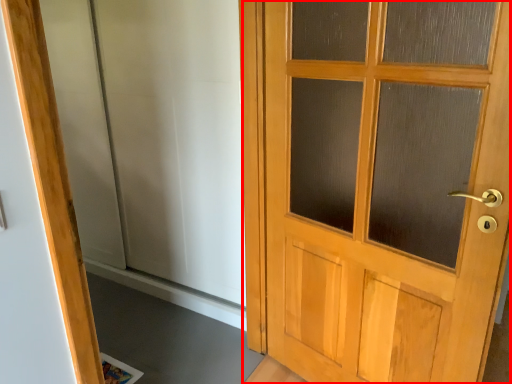
Question: From the image's perspective, considering the relative positions of door (annotated by the red box) and elevator in the image provided, where is door (annotated by the red box) located with respect to the staircase?

Choices:
 (A) below
 (B) above

Answer: (A)